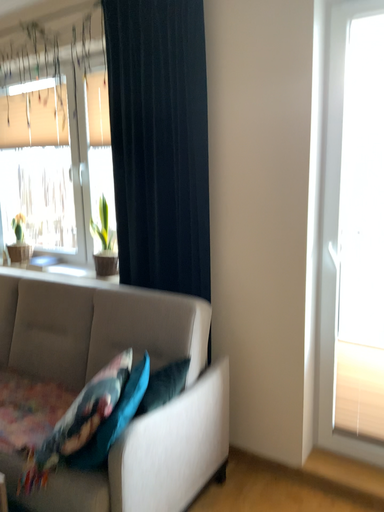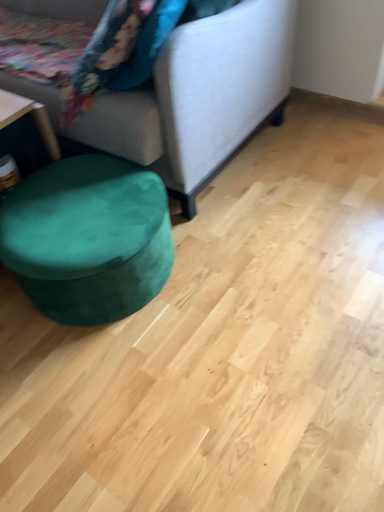
Question: How did the camera likely rotate when shooting the video?

Choices:
 (A) rotated upward
 (B) rotated downward

Answer: (B)